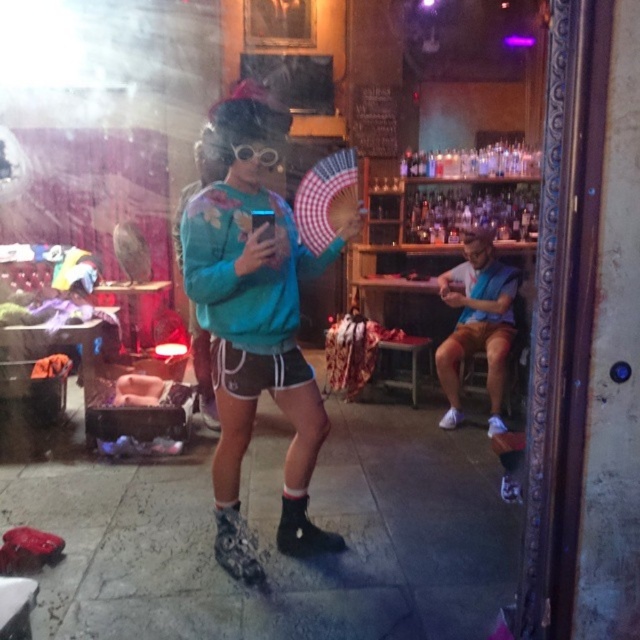
Question: In this image, where is blue fabric shirt at right located relative to clear plastic goggles at center?

Choices:
 (A) left
 (B) right

Answer: (B)

Question: Which object is closer to the camera taking this photo?

Choices:
 (A) blue fabric shirt at right
 (B) teal fabric sweatshirt at center

Answer: (B)

Question: Is teal fabric sweatshirt at center below blue fabric shirt at right?

Choices:
 (A) no
 (B) yes

Answer: (A)

Question: Observing the image, what is the correct spatial positioning of blue fabric shirt at right in reference to clear plastic goggles at center?

Choices:
 (A) below
 (B) above

Answer: (A)

Question: Which object is positioned farthest from the clear plastic goggles at center?

Choices:
 (A) blue fabric shirt at right
 (B) teal fabric sweatshirt at center

Answer: (A)

Question: Which object appears closest to the camera in this image?

Choices:
 (A) teal fabric sweatshirt at center
 (B) blue fabric shirt at right
 (C) clear plastic goggles at center

Answer: (A)